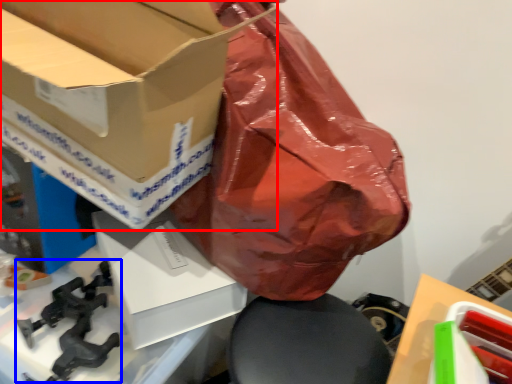
Question: Which of the following is the farthest to the observer, box (highlighted by a red box) or weapon (highlighted by a blue box)?

Choices:
 (A) box
 (B) weapon

Answer: (B)